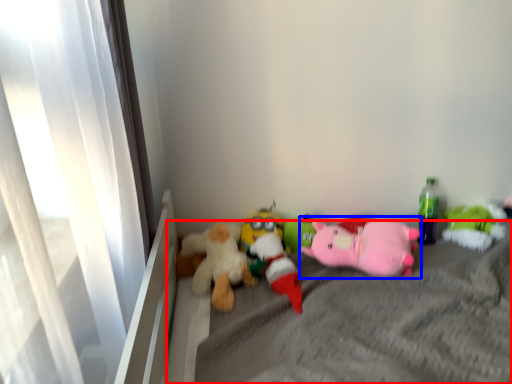
Question: Which of the following is the farthest to the observer, mattress (highlighted by a red box) or toy (highlighted by a blue box)?

Choices:
 (A) mattress
 (B) toy

Answer: (B)